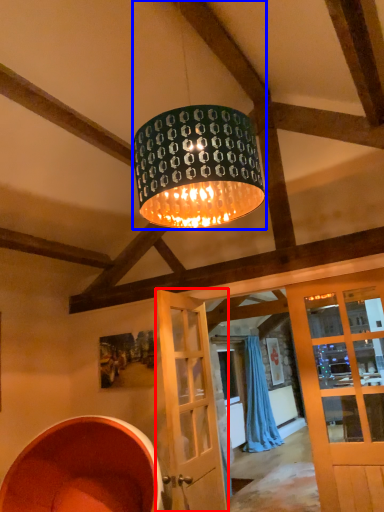
Question: Which object appears closest to the camera in this image, door (highlighted by a red box) or lamp (highlighted by a blue box)?

Choices:
 (A) door
 (B) lamp

Answer: (B)